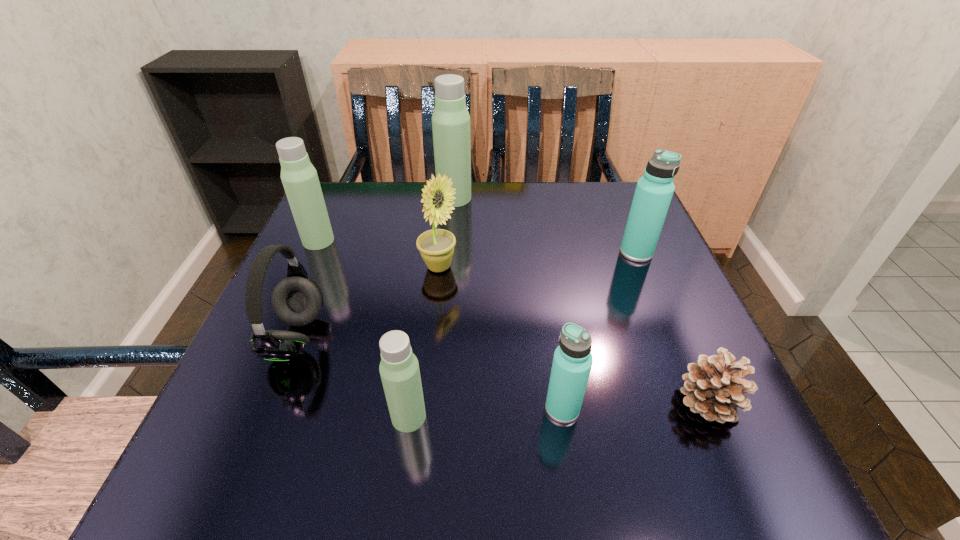
Find the location of `free location that satisfies the following two spatial constraints: 1. on the ear cups of the black headset; 2. on the back side of the shortest object`. free location that satisfies the following two spatial constraints: 1. on the ear cups of the black headset; 2. on the back side of the shortest object is located at coordinates (271, 401).

At what (x,y) coordinates should I click in order to perform the action: click on vacant space that satisfies the following two spatial constraints: 1. on the face of the sunflower; 2. on the back side of the sixth object from left to right. Please return your answer as a coordinate pair (x, y). Looking at the image, I should click on (423, 408).

Identify the location of vacant point that satisfies the following two spatial constraints: 1. on the back side of the second thermos bottle from right to left; 2. on the face of the sunflower. (540, 267).